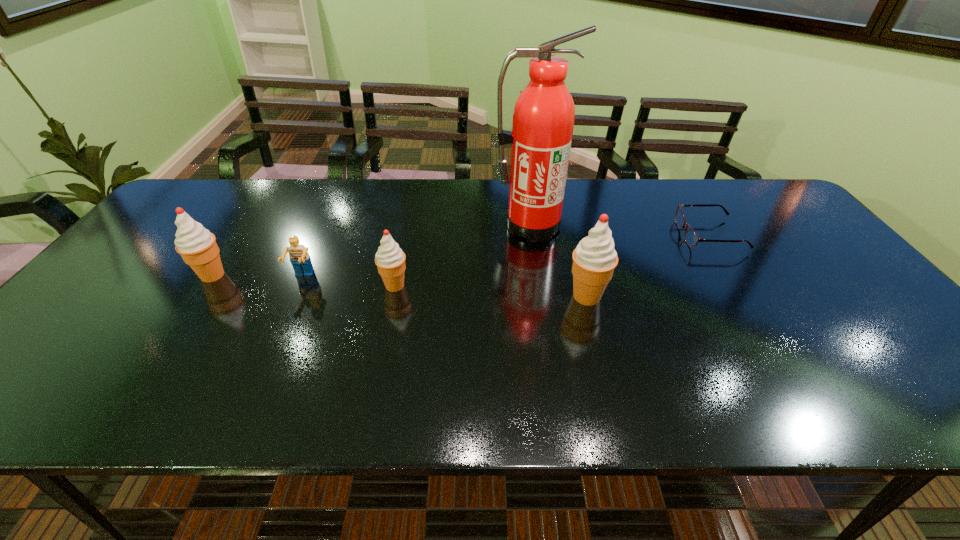
This screenshot has width=960, height=540. What are the coordinates of `free space in the image that satisfies the following two spatial constraints: 1. on the label side of the rightmost icecream; 2. on the left side of the tallest object` in the screenshot? It's located at (540, 296).